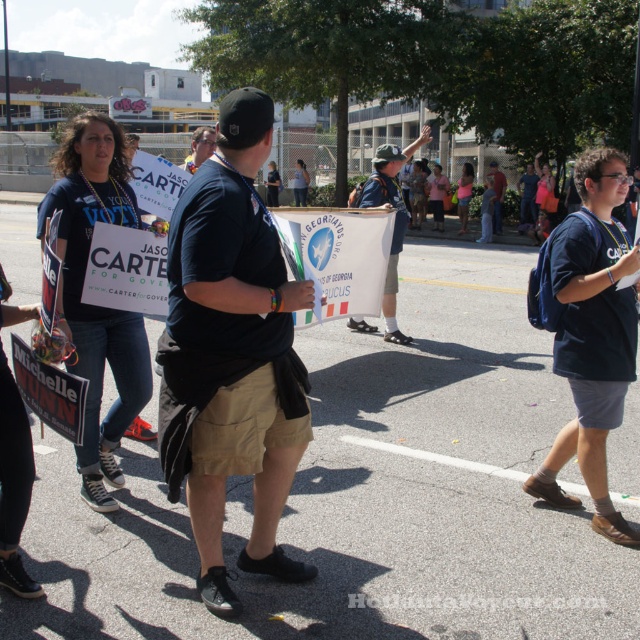
Question: Does black cotton t-shirt at center appear on the right side of black fabric shirt at center?

Choices:
 (A) no
 (B) yes

Answer: (B)

Question: Which of the following is the closest to the observer?

Choices:
 (A) denim shorts at center
 (B) black cotton t-shirt at center
 (C) blue cotton t-shirt at center

Answer: (B)

Question: Is black cotton t-shirt at center to the left of black fabric shirt at center from the viewer's perspective?

Choices:
 (A) yes
 (B) no

Answer: (B)

Question: Based on their relative distances, which object is farther from the denim shorts at center?

Choices:
 (A) black fabric shirt at center
 (B) blue cotton t-shirt at center
 (C) black cotton t-shirt at center

Answer: (A)

Question: Based on their relative distances, which object is nearer to the blue cotton t-shirt at center?

Choices:
 (A) denim shorts at center
 (B) black fabric shirt at center

Answer: (A)

Question: Can you confirm if black cotton t-shirt at center is bigger than black fabric shirt at center?

Choices:
 (A) yes
 (B) no

Answer: (B)